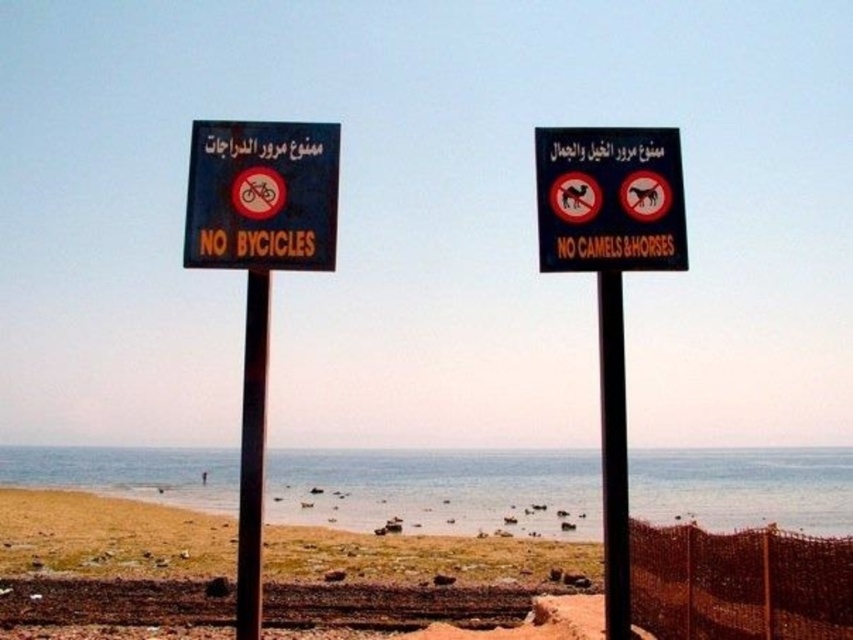
Question: Among these points, which one is nearest to the camera?

Choices:
 (A) (618, 472)
 (B) (624, 224)
 (C) (252, 272)

Answer: (A)

Question: Which point is farther to the camera?

Choices:
 (A) pos(299,148)
 (B) pos(619,280)
 (C) pos(241,410)

Answer: (C)

Question: Is black plastic sign at center above metallic pole at center?

Choices:
 (A) no
 (B) yes

Answer: (B)

Question: Estimate the real-world distances between objects in this image. Which object is farther from the black plastic signboard at left?

Choices:
 (A) black metal pole at center
 (B) black plastic sign at center
 (C) metallic pole at center

Answer: (A)

Question: Is black plastic sign at center above black metal pole at center?

Choices:
 (A) yes
 (B) no

Answer: (A)

Question: Is black plastic sign at center closer to the viewer compared to metallic pole at center?

Choices:
 (A) yes
 (B) no

Answer: (B)